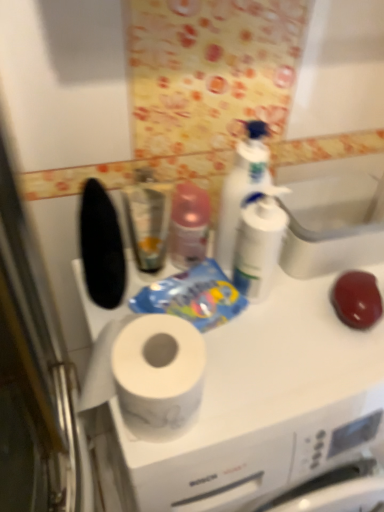
I want to click on free space in front of white plastic pump bottle at center, so click(x=269, y=367).